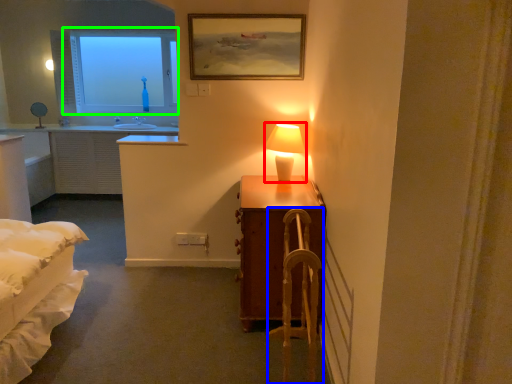
Question: Which object is positioned farthest from table lamp (highlighted by a red box)? Select from armchair (highlighted by a blue box) and window (highlighted by a green box).

Choices:
 (A) armchair
 (B) window

Answer: (B)